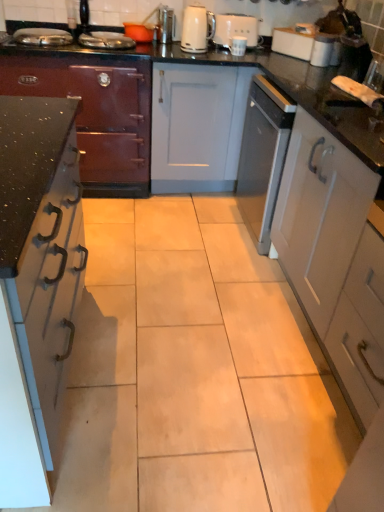
I want to click on free space in front of white glossy electric kettle at upper center, so click(x=204, y=55).